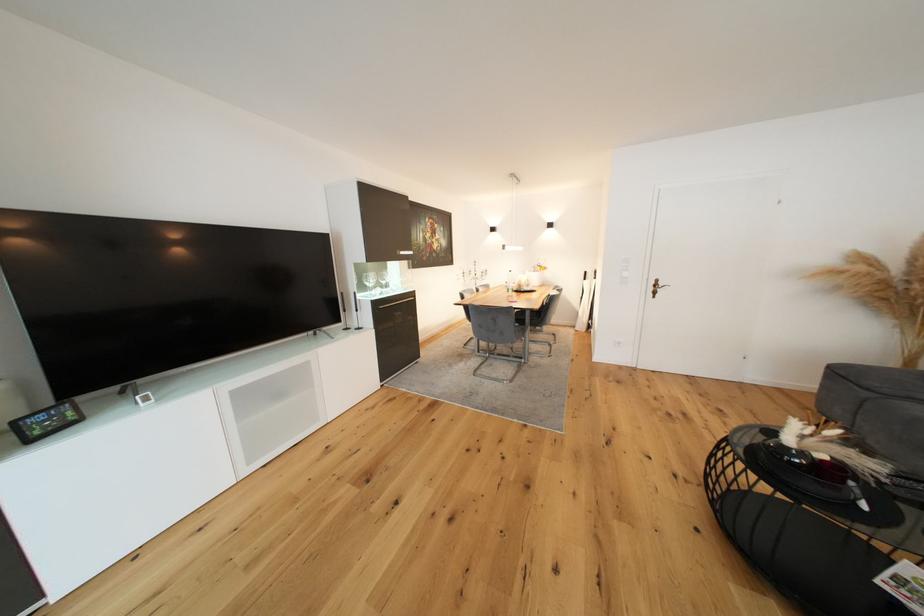
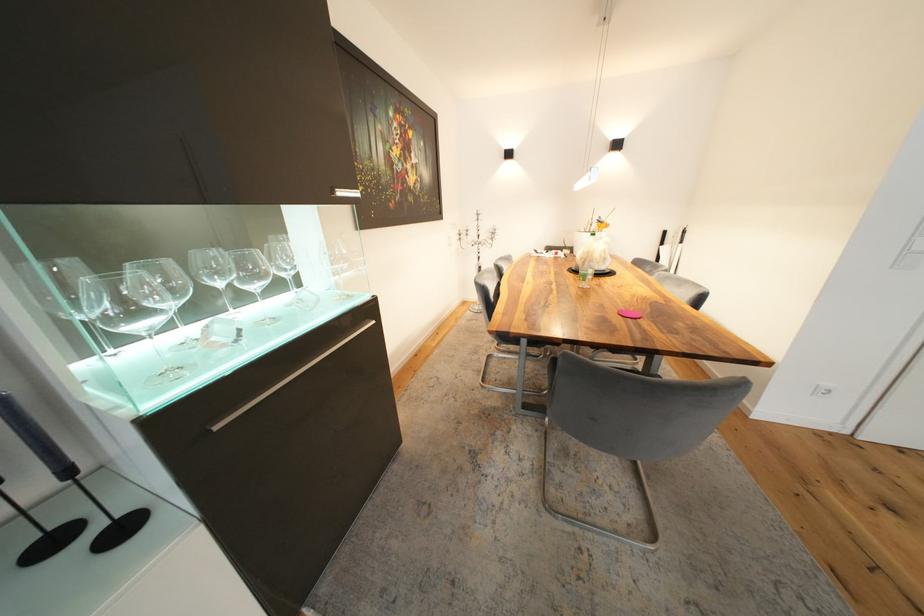
The point at [409,254] is marked in the first image. Where is the corresponding point in the second image?

(348, 195)